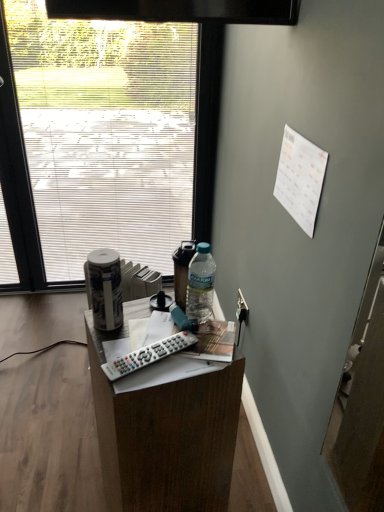
Find the location of a particular element. Image resolution: width=384 pixels, height=512 pixels. free space to the back side of white plastic remote control at center is located at coordinates (142, 324).